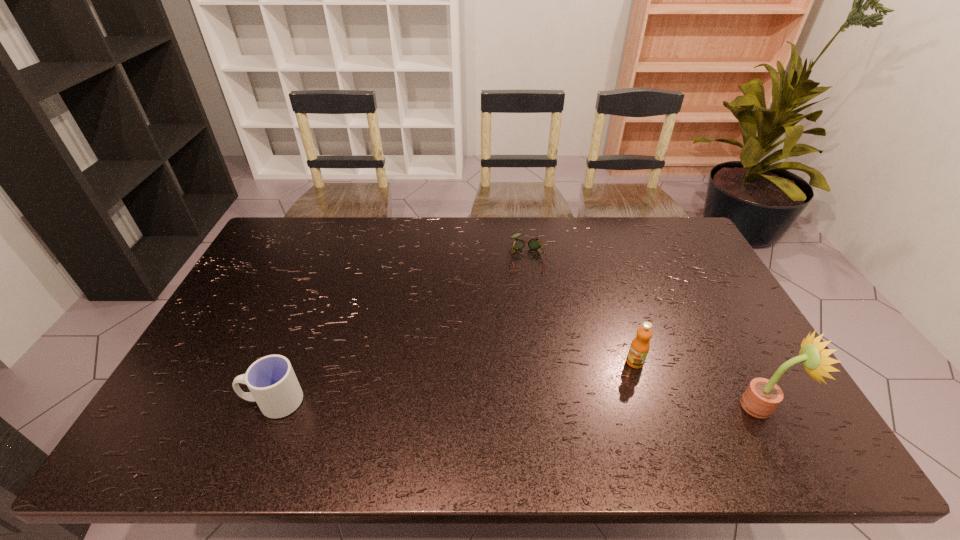
The width and height of the screenshot is (960, 540). I want to click on object situated at the right edge, so click(x=762, y=396).

Where is `object at the near right corner`? The height and width of the screenshot is (540, 960). object at the near right corner is located at coordinates (762, 396).

Where is `free space at the far edge of the desktop`? This screenshot has height=540, width=960. free space at the far edge of the desktop is located at coordinates (590, 252).

You are a GUI agent. You are given a task and a screenshot of the screen. Output one action in this format:
    pyautogui.click(x=<x>, y=<y>)
    Task: Click on the free space at the left edge
    The height and width of the screenshot is (540, 960).
    Given the screenshot: What is the action you would take?
    pyautogui.click(x=255, y=287)

This screenshot has width=960, height=540. In the image, there is a desktop. Find the location of `vacant space at the right edge`. vacant space at the right edge is located at coordinates (700, 280).

In the image, there is a desktop. Where is `vacant space at the far left corner`? vacant space at the far left corner is located at coordinates (316, 226).

Image resolution: width=960 pixels, height=540 pixels. In the image, there is a desktop. What are the coordinates of `vacant space at the near left corner` in the screenshot? It's located at (180, 396).

In the image, there is a desktop. Identify the location of vacant space at the far right corner. The height and width of the screenshot is (540, 960). (638, 220).

You are a GUI agent. You are given a task and a screenshot of the screen. Output one action in this format:
    pyautogui.click(x=<x>, y=<y>)
    Task: Click on the free space between the third tallest object and the third object from left to right
    The image size is (960, 540).
    Given the screenshot: What is the action you would take?
    pyautogui.click(x=454, y=382)

I want to click on empty location between the third object from right to left and the cup, so click(x=400, y=329).